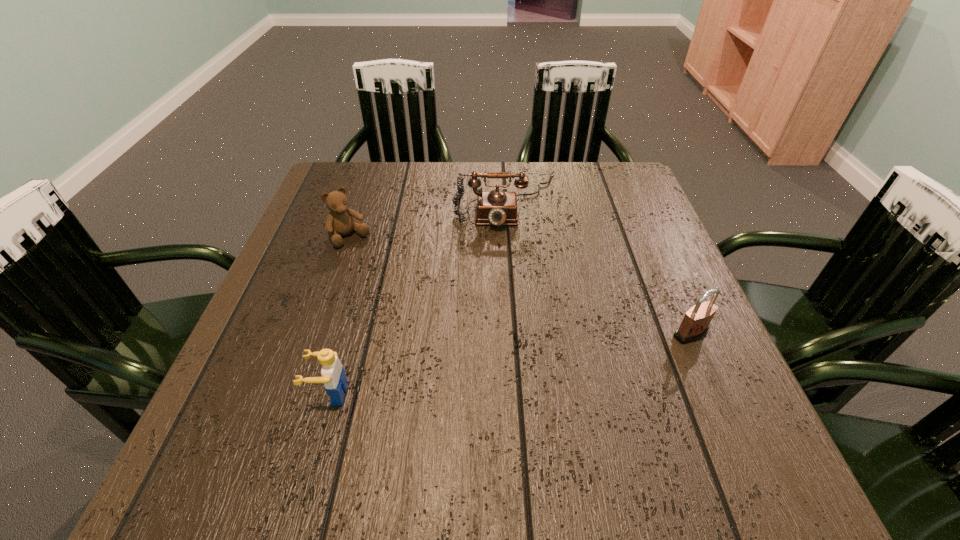
At what (x,y) coordinates should I click in order to perform the action: click on vacant space situated 0.390m on the front-facing side of the teddy bear. Please return your answer as a coordinate pair (x, y). The height and width of the screenshot is (540, 960). Looking at the image, I should click on (453, 355).

The height and width of the screenshot is (540, 960). I want to click on vacant area situated 0.350m on the front-facing side of the teddy bear, so click(x=441, y=341).

This screenshot has width=960, height=540. What are the coordinates of `free space located on the front-facing side of the teddy bear` in the screenshot? It's located at pos(399,294).

Locate an element on the screen. The width and height of the screenshot is (960, 540). object at the far edge is located at coordinates (496, 207).

Where is `object that is at the near edge`? object that is at the near edge is located at coordinates (333, 374).

Where is `Lego located in the left edge section of the desktop`? Image resolution: width=960 pixels, height=540 pixels. Lego located in the left edge section of the desktop is located at coordinates (333, 374).

This screenshot has height=540, width=960. I want to click on teddy bear positioned at the left edge, so click(x=339, y=222).

You are a GUI agent. You are given a task and a screenshot of the screen. Output one action in this format:
    pyautogui.click(x=<x>, y=<y>)
    Task: Click on the object present at the right edge
    This screenshot has height=540, width=960.
    Given the screenshot: What is the action you would take?
    pyautogui.click(x=695, y=324)

Find the location of a particular element. object positioned at the near left corner is located at coordinates (333, 374).

The height and width of the screenshot is (540, 960). What are the coordinates of `blank area at the far edge` in the screenshot? It's located at (446, 165).